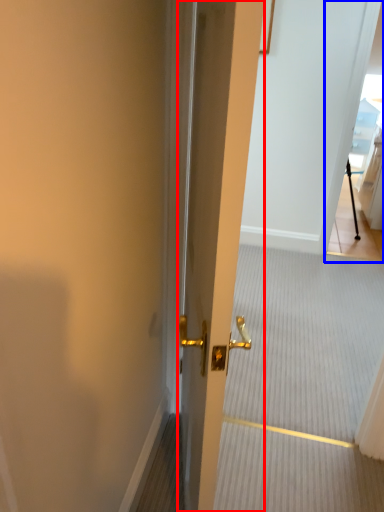
Question: Which point is further to the camera, door (highlighted by a red box) or glass door (highlighted by a blue box)?

Choices:
 (A) door
 (B) glass door

Answer: (B)